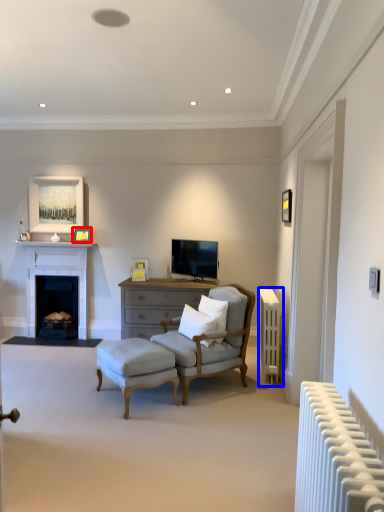
Question: Which point is further to the camera, picture frame (highlighted by a red box) or radiator (highlighted by a blue box)?

Choices:
 (A) picture frame
 (B) radiator

Answer: (A)